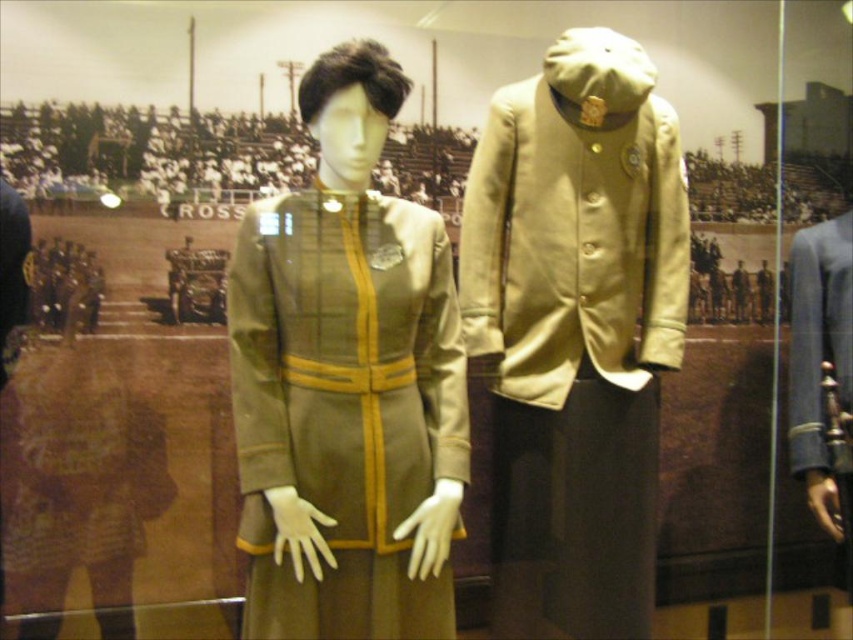
Between matte green fabric dress at center and light olive-green fabric jacket at center, which one is positioned lower?

matte green fabric dress at center is lower down.

Does matte green fabric dress at center have a greater width compared to light olive-green fabric jacket at center?

Incorrect, matte green fabric dress at center's width does not surpass light olive-green fabric jacket at center's.

At what (x,y) coordinates should I click in order to perform the action: click on matte green fabric dress at center. Please return your answer as a coordinate pair (x, y). Looking at the image, I should click on (347, 381).

At what (x,y) coordinates should I click in order to perform the action: click on matte green fabric dress at center. Please return your answer as a coordinate pair (x, y). The width and height of the screenshot is (853, 640). Looking at the image, I should click on (347, 381).